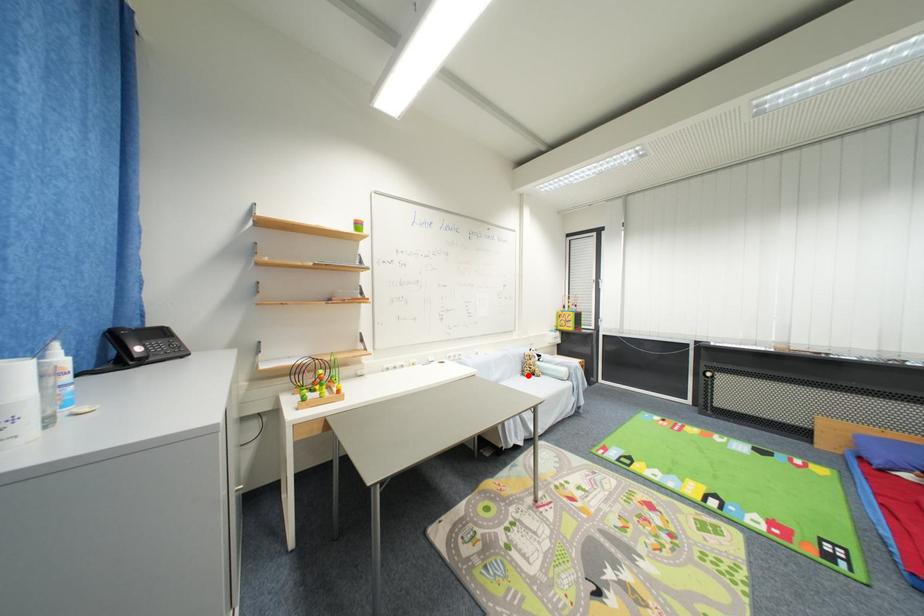
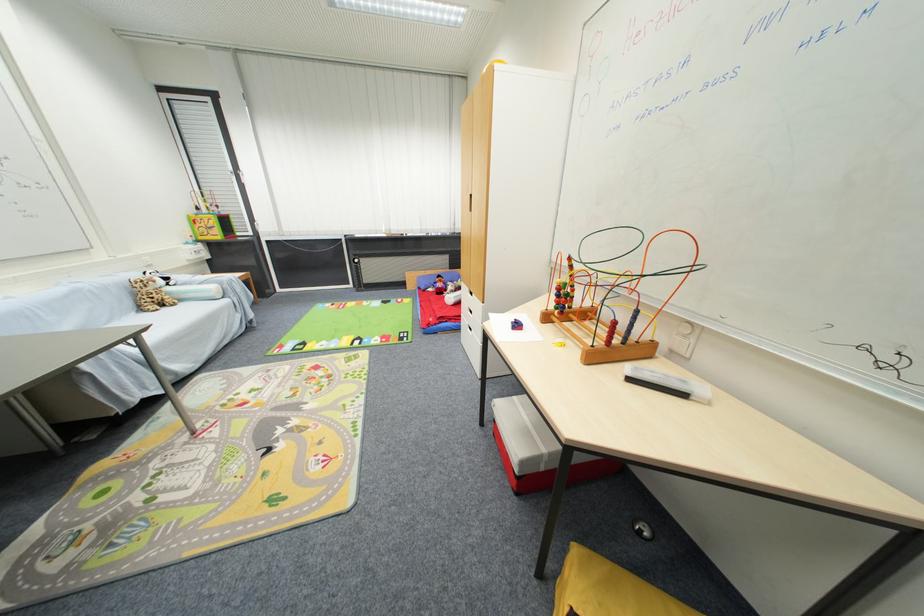
Question: I am providing you with two images of the same scene from different viewpoints. In image1, a red point is highlighted. Considering the same 3D point in image2, which of the following is correct?

Choices:
 (A) It is closer
 (B) It is farther

Answer: (A)